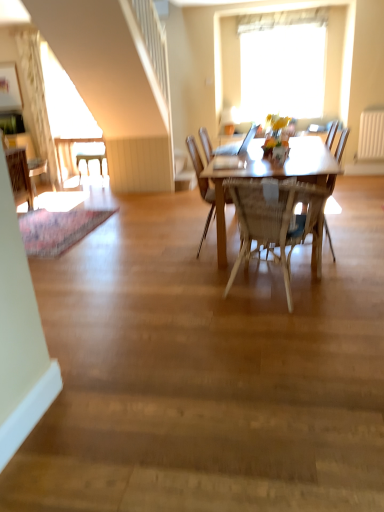
You are a GUI agent. You are given a task and a screenshot of the screen. Output one action in this format:
    pyautogui.click(x=<x>, y=<y>)
    Task: Click on the vacant space in between woven wood chair at center, marked as the 5th chair in a back-to-front arrangement, and light brown wooden table at center
    The image size is (384, 512).
    Given the screenshot: What is the action you would take?
    pyautogui.click(x=228, y=272)